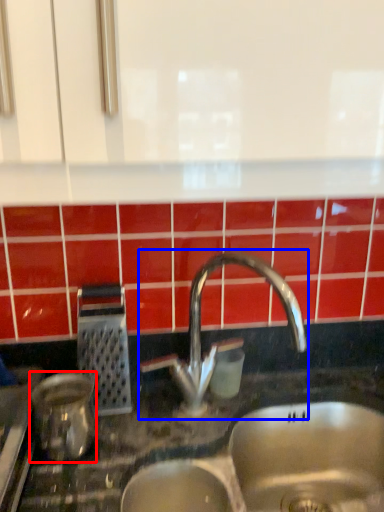
Question: Which object appears closest to the camera in this image, appliance (highlighted by a red box) or tap (highlighted by a blue box)?

Choices:
 (A) appliance
 (B) tap

Answer: (A)